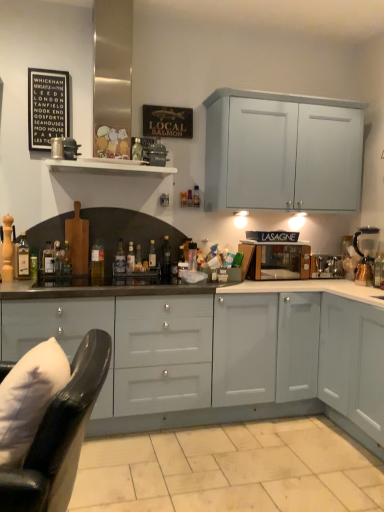
I want to click on free space in front of translucent glass bottle at center, which is the 8th bottle from right to left, so click(x=43, y=280).